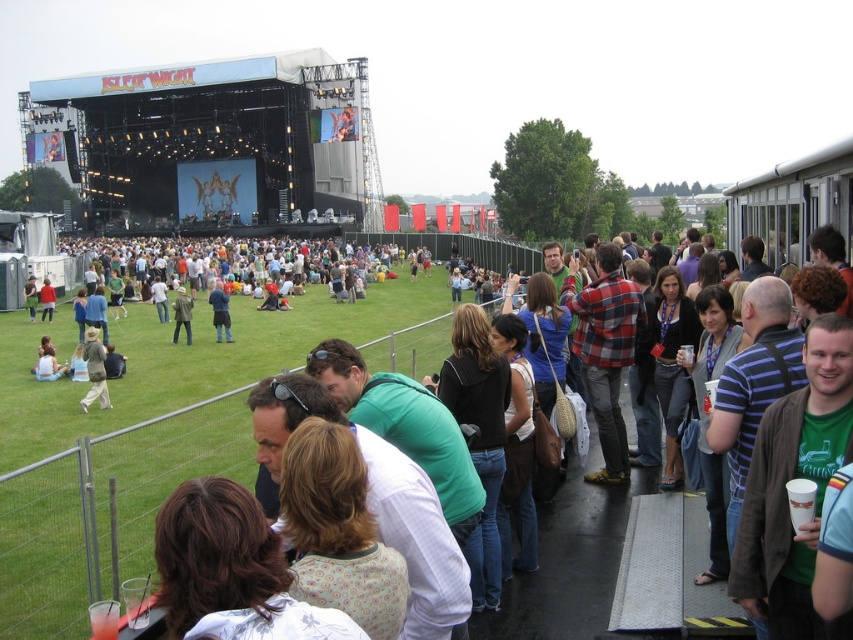
Is green fabric jacket at center above khaki cotton jacket at center?

Yes.

The height and width of the screenshot is (640, 853). In order to click on green fabric jacket at center in this screenshot , I will do `click(219, 312)`.

Does green grass at center have a smaller size compared to khaki cotton pants at lower left?

Incorrect, green grass at center is not smaller in size than khaki cotton pants at lower left.

Can you confirm if green grass at center is taller than khaki cotton pants at lower left?

Correct, green grass at center is much taller as khaki cotton pants at lower left.

Where is `green grass at center`? The width and height of the screenshot is (853, 640). green grass at center is located at coordinates (103, 512).

The height and width of the screenshot is (640, 853). In order to click on green grass at center in this screenshot , I will do `click(103, 512)`.

Is point (33, 509) closer to camera compared to point (173, 333)?

That is True.

Is green grass at center bigger than khaki cotton jacket at center?

Indeed, green grass at center has a larger size compared to khaki cotton jacket at center.

Between point (68, 556) and point (187, 339), which one is positioned in front?

Point (68, 556)

Where is `green grass at center`? Image resolution: width=853 pixels, height=640 pixels. green grass at center is located at coordinates (103, 512).